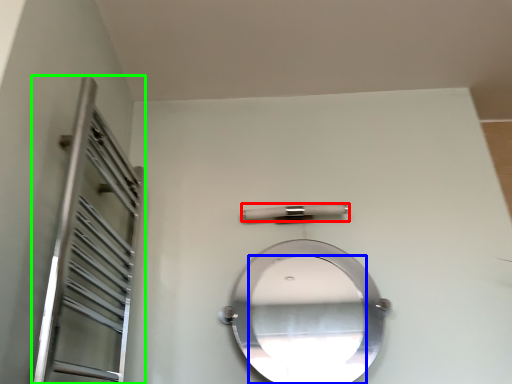
Question: Based on their relative distances, which object is farther from door handle (highlighted by a red box)? Choose from mirror (highlighted by a blue box) and screen door (highlighted by a green box).

Choices:
 (A) mirror
 (B) screen door

Answer: (A)